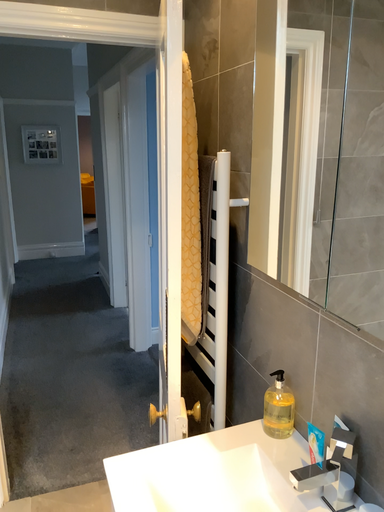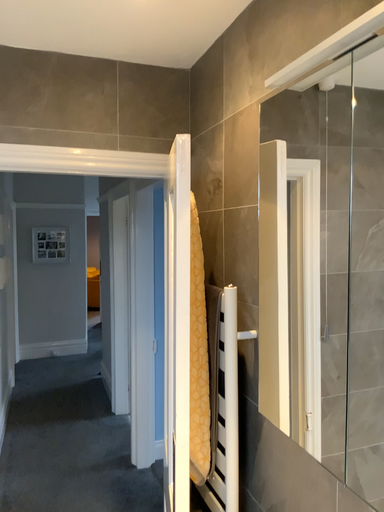
Question: How did the camera likely rotate when shooting the video?

Choices:
 (A) rotated downward
 (B) rotated upward

Answer: (B)